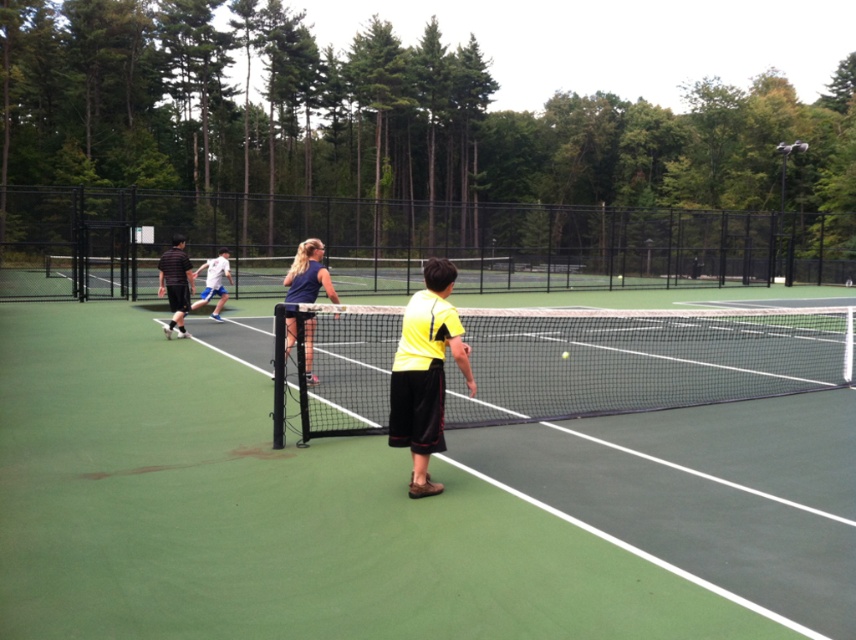
You are a photographer standing at the edge of the tennis court. You need to capture a photo that includes both the green synthetic surface at center and the dark blue jersey at center. Based on their sizes in the image, which object will appear larger in the final photo?

The green synthetic surface at center will appear larger in the photo because it is much taller than the dark blue jersey at center according to the description.

You are a photographer standing at the edge of the tennis court. You want to take a photo that includes both the green synthetic surface at center and the dark blue jersey at center. What is the minimum distance you need to move backward from the court to ensure both objects are fully visible in your frame?

The minimum distance you need to move backward is determined by the distance between the green synthetic surface at center and the dark blue jersey at center, which is 3.92 meters. To include both in the frame, you should position yourself at least 3.92 meters away from the closer object to ensure both are captured.

You are a photographer wanting to capture the tennis court scene. You notice the green synthetic surface at center and the dark blue jersey at center. Which object is positioned to the left of the other?

The green synthetic surface at center is to the left of the dark blue jersey at center.